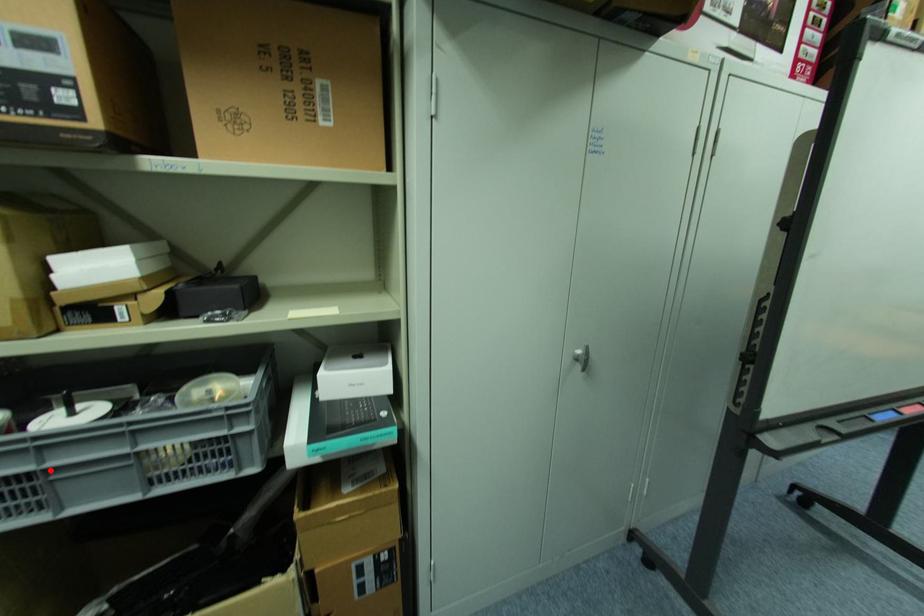
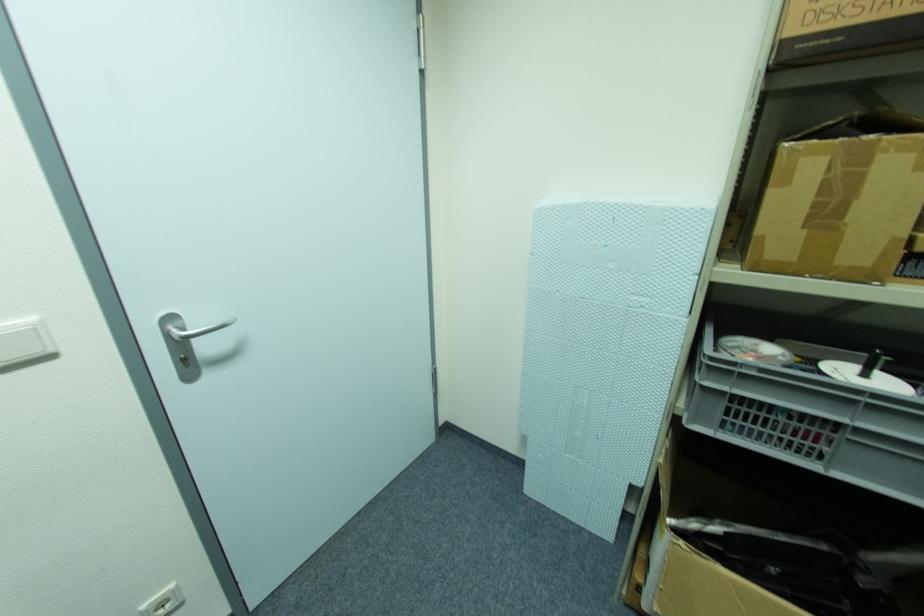
Find the pixel in the second image that matches the highlighted location in the first image.

(859, 432)